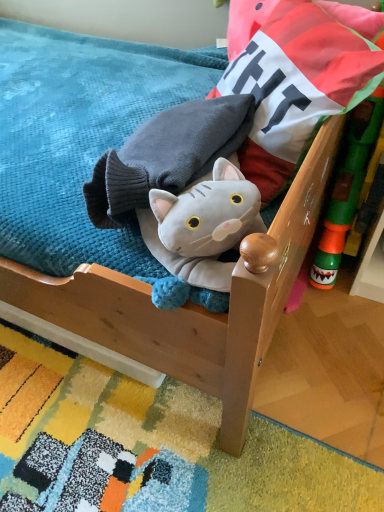
This screenshot has height=512, width=384. What do you see at coordinates (295, 75) in the screenshot?
I see `velvet cushion at upper right` at bounding box center [295, 75].

The height and width of the screenshot is (512, 384). Identify the location of green plastic toy at right. (347, 189).

Based on their positions, is soft blue fabric at upper left located to the left or right of velvet cushion at upper right?

soft blue fabric at upper left is to the left of velvet cushion at upper right.

Looking at this image, from a real-world perspective, who is located higher, soft blue fabric at upper left or velvet cushion at upper right?

From a 3D spatial view, velvet cushion at upper right is above.

From the image's perspective, which object appears higher, soft blue fabric at upper left or velvet cushion at upper right?

velvet cushion at upper right is shown above in the image.

Image resolution: width=384 pixels, height=512 pixels. I want to click on toy below the soft blue fabric at upper left (from a real-world perspective), so tap(347, 189).

Can you tell me how much green plastic toy at right and soft blue fabric at upper left differ in facing direction?

They differ by 103 degrees in their facing directions.

Between green plastic toy at right and soft blue fabric at upper left, which one has larger size?

soft blue fabric at upper left.

From the image's perspective, is green plastic toy at right on soft blue fabric at upper left?

Actually, green plastic toy at right appears below soft blue fabric at upper left in the image.

From a real-world perspective, is velvet cushion at upper right on green plastic toy at right?

Yes.

Is velvet cushion at upper right inside or outside of green plastic toy at right?

velvet cushion at upper right lies outside green plastic toy at right.

Considering the relative sizes of velvet cushion at upper right and green plastic toy at right in the image provided, is velvet cushion at upper right shorter than green plastic toy at right?

Correct, velvet cushion at upper right is not as tall as green plastic toy at right.

Does point (259, 89) come farther from viewer compared to point (342, 205)?

No, (259, 89) is in front of (342, 205).

Which of these two, velvet cushion at upper right or soft blue fabric at upper left, is wider?

velvet cushion at upper right.

Is velvet cushion at upper right placed right next to soft blue fabric at upper left?

There is a gap between velvet cushion at upper right and soft blue fabric at upper left.

Is soft blue fabric at upper left smaller than green plastic toy at right?

Incorrect, soft blue fabric at upper left is not smaller in size than green plastic toy at right.

Is the depth of soft blue fabric at upper left less than that of green plastic toy at right?

Yes, it is in front of green plastic toy at right.

Is soft blue fabric at upper left oriented towards green plastic toy at right?

No, soft blue fabric at upper left is not aimed at green plastic toy at right.

Is soft blue fabric at upper left at the right side of green plastic toy at right?

No.

From the image's perspective, is green plastic toy at right on top of velvet cushion at upper right?

No, from the image's perspective, green plastic toy at right is not on top of velvet cushion at upper right.

Considering the sizes of objects green plastic toy at right and velvet cushion at upper right in the image provided, who is thinner, green plastic toy at right or velvet cushion at upper right?

With smaller width is green plastic toy at right.

Considering the relative sizes of green plastic toy at right and velvet cushion at upper right in the image provided, is green plastic toy at right shorter than velvet cushion at upper right?

In fact, green plastic toy at right may be taller than velvet cushion at upper right.

From a real-world perspective, between green plastic toy at right and velvet cushion at upper right, who is vertically higher?

velvet cushion at upper right.

This screenshot has width=384, height=512. Identify the location of mattress to the left of velvet cushion at upper right. (79, 137).

Where is `toy below the soft blue fabric at upper left (from a real-world perspective)`? The image size is (384, 512). toy below the soft blue fabric at upper left (from a real-world perspective) is located at coordinates (347, 189).

Which object lies nearer to the anchor point green plastic toy at right, soft blue fabric at upper left or velvet cushion at upper right?

Among the two, velvet cushion at upper right is located nearer to green plastic toy at right.

Looking at the image, which one is located closer to velvet cushion at upper right, green plastic toy at right or soft blue fabric at upper left?

green plastic toy at right is closer to velvet cushion at upper right.

Which object lies further to the anchor point velvet cushion at upper right, soft blue fabric at upper left or green plastic toy at right?

soft blue fabric at upper left lies further to velvet cushion at upper right than the other object.

From the image, which object appears to be farther from soft blue fabric at upper left, velvet cushion at upper right or green plastic toy at right?

green plastic toy at right is further to soft blue fabric at upper left.

Estimate the real-world distances between objects in this image. Which object is further from soft blue fabric at upper left, green plastic toy at right or velvet cushion at upper right?

green plastic toy at right is positioned further to the anchor soft blue fabric at upper left.

When comparing their distances from green plastic toy at right, does velvet cushion at upper right or soft blue fabric at upper left seem further?

Among the two, soft blue fabric at upper left is located further to green plastic toy at right.

At what (x,y) coordinates should I click in order to perform the action: click on pillow located between soft blue fabric at upper left and green plastic toy at right in the left-right direction. Please return your answer as a coordinate pair (x, y). Image resolution: width=384 pixels, height=512 pixels. Looking at the image, I should click on (295, 75).